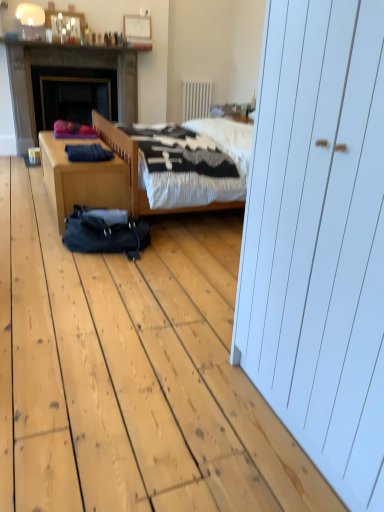
Question: Does white textured radiator at upper center have a greater height compared to dark gray stone fireplace at left?

Choices:
 (A) yes
 (B) no

Answer: (B)

Question: Is white textured radiator at upper center positioned with its back to dark gray stone fireplace at left?

Choices:
 (A) yes
 (B) no

Answer: (B)

Question: Can you confirm if white textured radiator at upper center is positioned to the right of dark gray stone fireplace at left?

Choices:
 (A) no
 (B) yes

Answer: (B)

Question: Are white textured radiator at upper center and dark gray stone fireplace at left located far from each other?

Choices:
 (A) yes
 (B) no

Answer: (A)

Question: Considering the relative sizes of white textured radiator at upper center and dark gray stone fireplace at left in the image provided, is white textured radiator at upper center thinner than dark gray stone fireplace at left?

Choices:
 (A) no
 (B) yes

Answer: (B)

Question: Is wooden desk at lower left bigger or smaller than white textured radiator at upper center?

Choices:
 (A) small
 (B) big

Answer: (B)

Question: Is wooden desk at lower left spatially inside white textured radiator at upper center, or outside of it?

Choices:
 (A) inside
 (B) outside

Answer: (B)

Question: Is point (39, 138) closer or farther from the camera than point (190, 89)?

Choices:
 (A) farther
 (B) closer

Answer: (B)

Question: Considering the relative positions of wooden desk at lower left and white textured radiator at upper center in the image provided, is wooden desk at lower left to the left or to the right of white textured radiator at upper center?

Choices:
 (A) right
 (B) left

Answer: (B)

Question: Does point pos(48,160) appear closer or farther from the camera than point pos(114,248)?

Choices:
 (A) farther
 (B) closer

Answer: (A)

Question: In terms of height, does wooden desk at lower left look taller or shorter compared to black fabric sleeping bag at center?

Choices:
 (A) tall
 (B) short

Answer: (A)

Question: In the image, is wooden desk at lower left positioned in front of or behind black fabric sleeping bag at center?

Choices:
 (A) front
 (B) behind

Answer: (B)

Question: From the image's perspective, relative to black fabric sleeping bag at center, is wooden desk at lower left above or below?

Choices:
 (A) above
 (B) below

Answer: (A)

Question: Is point (206, 105) closer or farther from the camera than point (130, 90)?

Choices:
 (A) farther
 (B) closer

Answer: (A)

Question: Considering the relative positions of white textured radiator at upper center and dark gray stone fireplace at left in the image provided, is white textured radiator at upper center to the left or to the right of dark gray stone fireplace at left?

Choices:
 (A) right
 (B) left

Answer: (A)